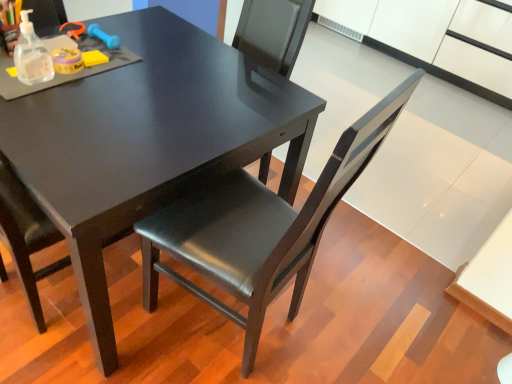
Question: Is matte black chair at center surrounded by matte black table at center?

Choices:
 (A) yes
 (B) no

Answer: (B)

Question: From the image's perspective, is matte black table at center located beneath matte black chair at center?

Choices:
 (A) no
 (B) yes

Answer: (A)

Question: Is matte black table at center positioned far away from matte black chair at center?

Choices:
 (A) yes
 (B) no

Answer: (B)

Question: Considering the relative sizes of matte black table at center and matte black chair at center in the image provided, is matte black table at center bigger than matte black chair at center?

Choices:
 (A) no
 (B) yes

Answer: (B)

Question: Is the surface of matte black table at center in direct contact with matte black chair at center?

Choices:
 (A) no
 (B) yes

Answer: (A)

Question: From the image's perspective, is matte black table at center on matte black chair at center?

Choices:
 (A) yes
 (B) no

Answer: (A)

Question: Is matte black chair at center beside matte black table at center?

Choices:
 (A) no
 (B) yes

Answer: (A)

Question: From a real-world perspective, is matte black chair at center physically below matte black table at center?

Choices:
 (A) no
 (B) yes

Answer: (A)

Question: Does matte black chair at center have a lesser height compared to matte black table at center?

Choices:
 (A) no
 (B) yes

Answer: (A)

Question: Considering the relative sizes of matte black chair at center and matte black table at center in the image provided, is matte black chair at center thinner than matte black table at center?

Choices:
 (A) yes
 (B) no

Answer: (A)

Question: Is matte black chair at center positioned with its back to matte black table at center?

Choices:
 (A) yes
 (B) no

Answer: (B)

Question: Can you confirm if matte black chair at center is taller than matte black table at center?

Choices:
 (A) yes
 (B) no

Answer: (A)

Question: From the image's perspective, is matte black table at center located above or below matte black chair at center?

Choices:
 (A) above
 (B) below

Answer: (A)